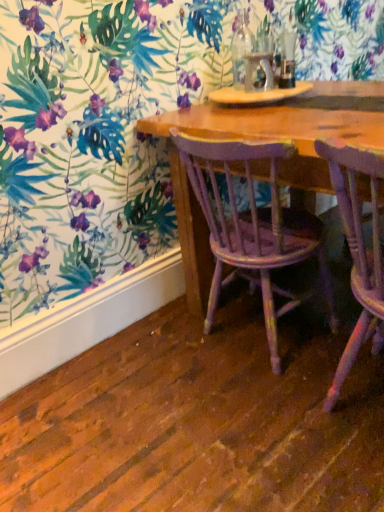
Question: Is distressed purple wood chair at center, the first chair in the left-to-right sequence, taller or shorter than purple painted wood chair at lower right, positioned as the second chair in left-to-right order?

Choices:
 (A) short
 (B) tall

Answer: (A)

Question: From the image's perspective, relative to purple painted wood chair at lower right, the first chair viewed from the right, is distressed purple wood chair at center, the first chair in the left-to-right sequence, above or below?

Choices:
 (A) below
 (B) above

Answer: (B)

Question: In the image, is distressed purple wood chair at center, arranged as the second chair when viewed from the right, on the left side or the right side of purple painted wood chair at lower right, the first chair viewed from the right?

Choices:
 (A) right
 (B) left

Answer: (B)

Question: From the image's perspective, is purple painted wood chair at lower right, the first chair viewed from the right, located above or below distressed purple wood chair at center, the first chair in the left-to-right sequence?

Choices:
 (A) above
 (B) below

Answer: (B)

Question: Is point (379, 340) closer or farther from the camera than point (269, 244)?

Choices:
 (A) farther
 (B) closer

Answer: (B)

Question: Is purple painted wood chair at lower right, positioned as the second chair in left-to-right order, wider or thinner than distressed purple wood chair at center, the first chair in the left-to-right sequence?

Choices:
 (A) thin
 (B) wide

Answer: (B)

Question: Considering the positions of purple painted wood chair at lower right, positioned as the second chair in left-to-right order, and distressed purple wood chair at center, the first chair in the left-to-right sequence, in the image, is purple painted wood chair at lower right, positioned as the second chair in left-to-right order, taller or shorter than distressed purple wood chair at center, the first chair in the left-to-right sequence,?

Choices:
 (A) tall
 (B) short

Answer: (A)